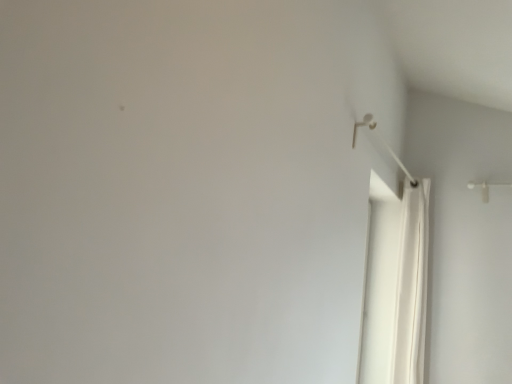
Question: From the image's perspective, is white fabric shower curtain at right positioned above or below white plastic shower at upper right?

Choices:
 (A) above
 (B) below

Answer: (B)

Question: Is white fabric shower curtain at right bigger or smaller than white plastic shower at upper right?

Choices:
 (A) small
 (B) big

Answer: (B)

Question: Considering the positions of white fabric shower curtain at right and white plastic shower at upper right in the image, is white fabric shower curtain at right wider or thinner than white plastic shower at upper right?

Choices:
 (A) thin
 (B) wide

Answer: (B)

Question: Based on their positions, is white plastic shower at upper right located to the left or right of white fabric shower curtain at right?

Choices:
 (A) left
 (B) right

Answer: (A)

Question: Is white plastic shower at upper right taller or shorter than white fabric shower curtain at right?

Choices:
 (A) tall
 (B) short

Answer: (B)

Question: Looking at the image, does white plastic shower at upper right seem bigger or smaller compared to white fabric shower curtain at right?

Choices:
 (A) small
 (B) big

Answer: (A)

Question: Is white plastic shower at upper right in front of or behind white fabric shower curtain at right in the image?

Choices:
 (A) behind
 (B) front

Answer: (B)